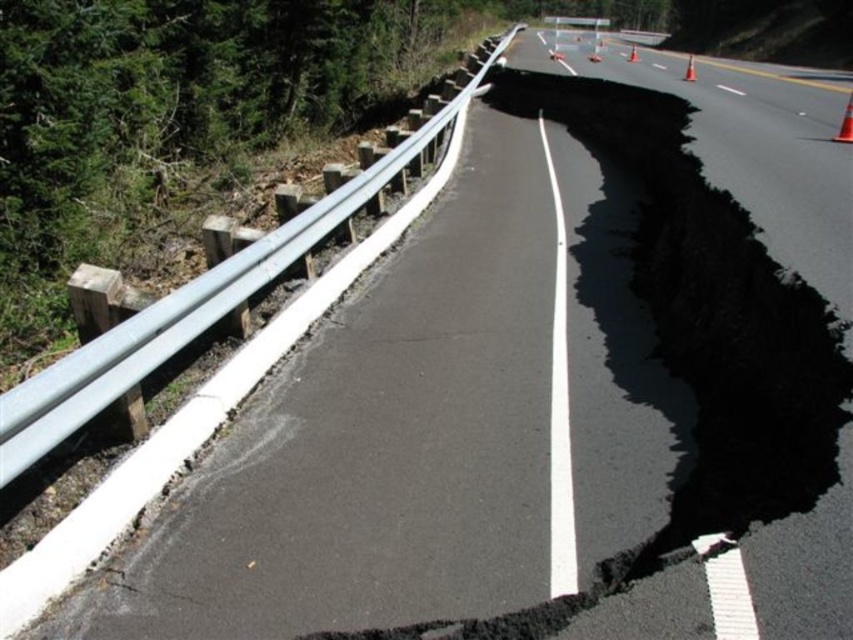
Question: Is orange plastic traffic cone at upper right bigger than orange plastic traffic cone at upper center?

Choices:
 (A) no
 (B) yes

Answer: (B)

Question: Does orange cone at upper right have a larger size compared to orange plastic cone at upper center?

Choices:
 (A) no
 (B) yes

Answer: (B)

Question: Which point is farther to the camera?

Choices:
 (A) (635, 54)
 (B) (555, 45)
 (C) (691, 80)
 (D) (596, 61)

Answer: (B)

Question: Among these objects, which one is farthest from the camera?

Choices:
 (A) orange plastic traffic cone at upper right
 (B) orange cone at upper right
 (C) orange plastic cone at upper center

Answer: (C)

Question: Does orange plastic traffic cone at upper right appear over orange plastic traffic cone at upper center?

Choices:
 (A) yes
 (B) no

Answer: (A)

Question: Which point is farther to the camera?

Choices:
 (A) (556, 44)
 (B) (846, 115)
 (C) (637, 54)
 (D) (590, 58)

Answer: (A)